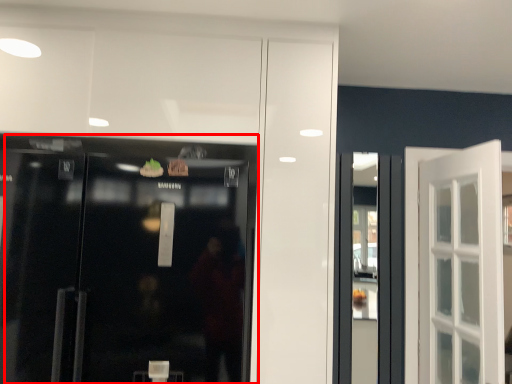
Question: From the image, what is the correct spatial relationship of door (annotated by the red box) in relation to shop window?

Choices:
 (A) left
 (B) right

Answer: (A)